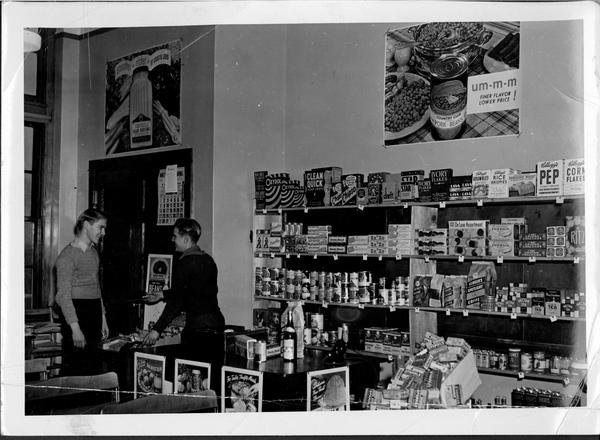
The image size is (600, 440). Identify the location of black and white photowalls. (243, 199), (350, 105), (83, 147).